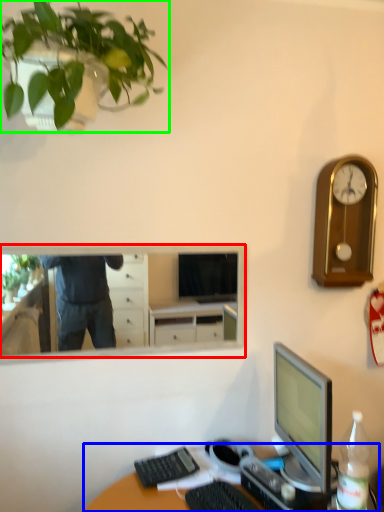
Question: Which is nearer to the mirror (highlighted by a red box)? desk (highlighted by a blue box) or houseplant (highlighted by a green box).

Choices:
 (A) desk
 (B) houseplant

Answer: (A)